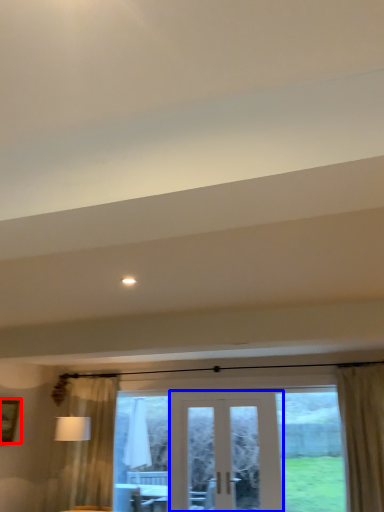
Question: Which object appears closest to the camera in this image, picture frame (highlighted by a red box) or door (highlighted by a blue box)?

Choices:
 (A) picture frame
 (B) door

Answer: (B)